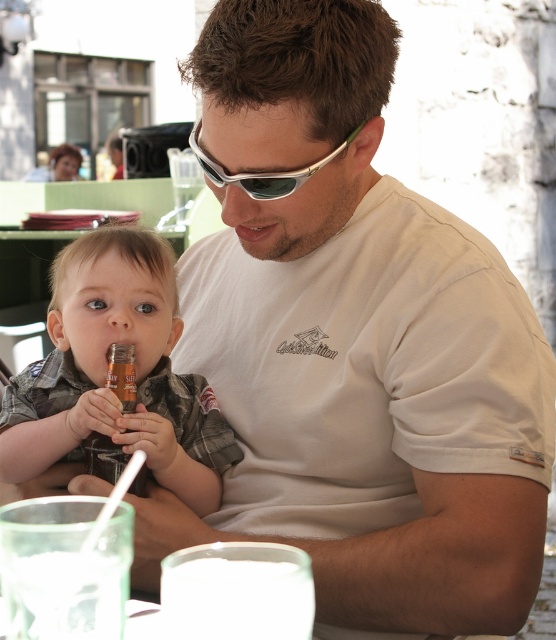
You are a waiter at the outdoor cafe. You need to place a new drink order for the customer. Which item should you prioritize replacing first between the matte plastic bottle at left and the silver metallic sunglasses at center, based on their current positions and the scene context?

The matte plastic bottle at left should be prioritized for replacement since it is taller than the silver metallic sunglasses at center, indicating it might be a drink container that needs refilling or replacement.